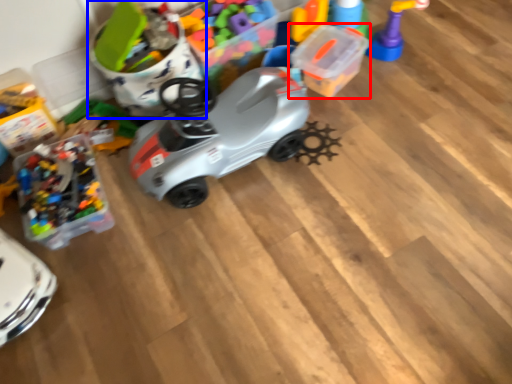
Question: Which point is further to the camera, toy (highlighted by a red box) or toy (highlighted by a blue box)?

Choices:
 (A) toy
 (B) toy

Answer: (A)